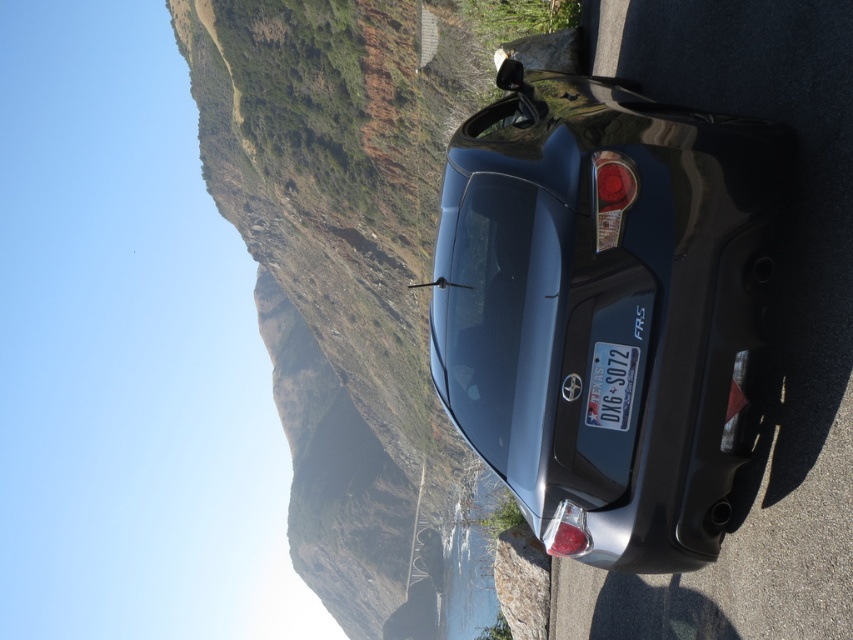
Is satin black car at center smaller than metallic blue license plate at center?

Incorrect, satin black car at center is not smaller in size than metallic blue license plate at center.

Is satin black car at center to the left of metallic blue license plate at center from the viewer's perspective?

Correct, you'll find satin black car at center to the left of metallic blue license plate at center.

This screenshot has height=640, width=853. What do you see at coordinates (602, 305) in the screenshot?
I see `satin black car at center` at bounding box center [602, 305].

You are a GUI agent. You are given a task and a screenshot of the screen. Output one action in this format:
    pyautogui.click(x=<x>, y=<y>)
    Task: Click on the satin black car at center
    
    Given the screenshot: What is the action you would take?
    pyautogui.click(x=602, y=305)